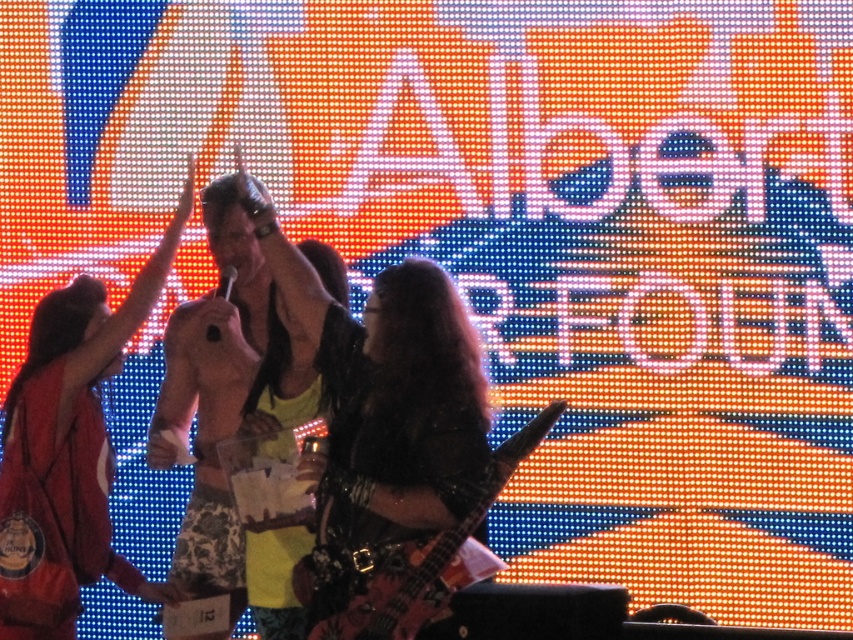
Question: Observing the image, what is the correct spatial positioning of shiny black dress at center in reference to shiny yellow tank top at center?

Choices:
 (A) right
 (B) left

Answer: (B)

Question: Which of these objects is positioned closest to the shiny yellow tank top at center?

Choices:
 (A) shiny black dress at center
 (B) wooden electric guitar at center

Answer: (A)

Question: Considering the real-world distances, which object is closest to the shiny yellow tank top at center?

Choices:
 (A) shiny black dress at center
 (B) wooden electric guitar at center

Answer: (A)

Question: Which point is farther to the camera?

Choices:
 (A) (322, 248)
 (B) (74, 602)

Answer: (A)

Question: Is shiny yellow tank top at center thinner than wooden electric guitar at center?

Choices:
 (A) yes
 (B) no

Answer: (A)

Question: Can you confirm if shiny black dress at center is positioned to the right of shiny yellow tank top at center?

Choices:
 (A) yes
 (B) no

Answer: (B)